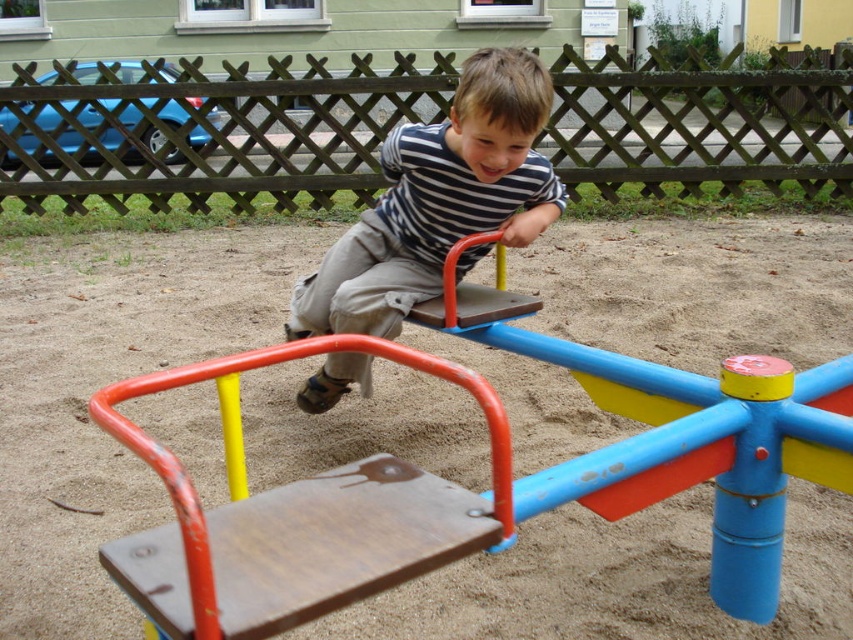
You are designing a new playground and want to ensure that the seesaw can accommodate both the brown wooden sand at center and the striped fabric shirt at center. Which object requires more horizontal space on the seesaw?

The brown wooden sand at center requires more horizontal space because its width is larger than the striped fabric shirt at center.

You are standing at the center of the playground and want to place a new bench between the two points, point (328, 228) and point (466, 164). According to the scene, which point should the bench be closer to in order to be in front of the seesaw?

The bench should be closer to point (466, 164) because point (328, 228) is behind point (466, 164), so placing it near the front point would position it in front of the seesaw.